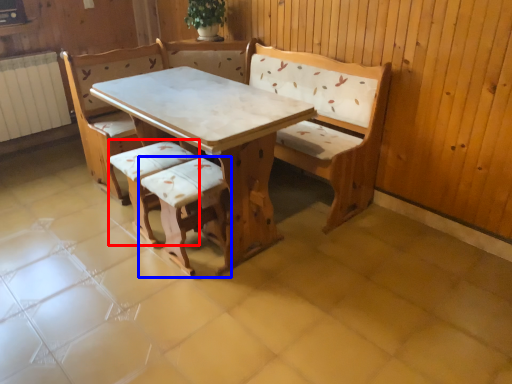
Question: Which object appears farthest to the camera in this image, armchair (highlighted by a red box) or armchair (highlighted by a blue box)?

Choices:
 (A) armchair
 (B) armchair

Answer: (A)